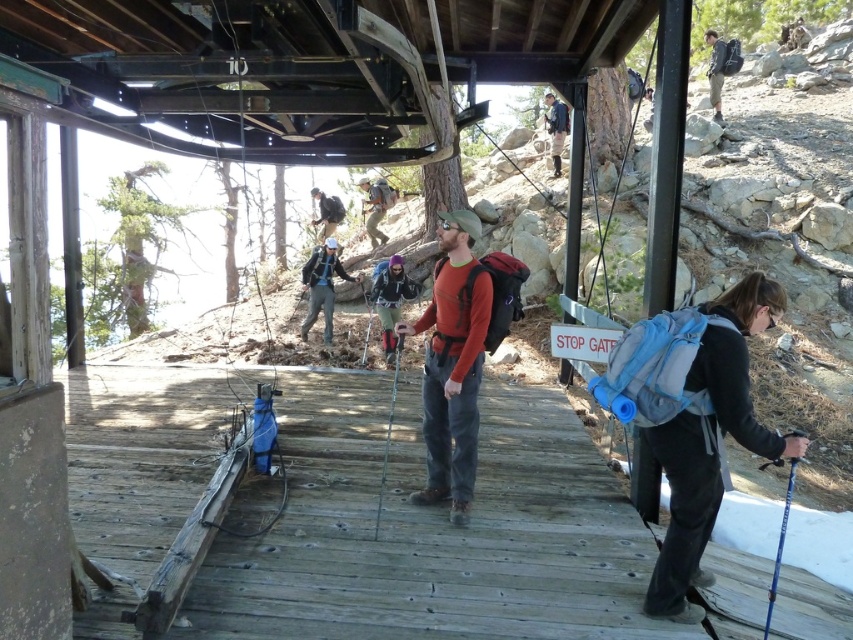
Question: Is orange fleece jacket at center above matte black backpack at center?

Choices:
 (A) yes
 (B) no

Answer: (B)

Question: Observing the image, what is the correct spatial positioning of camouflage fabric backpack at center in reference to metallic silver ski pole at center?

Choices:
 (A) below
 (B) above

Answer: (B)

Question: Which object is closer to the camera taking this photo?

Choices:
 (A) blue metallic ski pole at lower right
 (B) matte gray backpack at center

Answer: (A)

Question: Which point is closer to the camera?

Choices:
 (A) matte gray backpack at center
 (B) blue fabric backpack at right

Answer: (B)

Question: Which of the following is the farthest from the observer?

Choices:
 (A) blue fabric backpack at right
 (B) blue metallic ski pole at lower right

Answer: (B)

Question: Does orange fleece jacket at center come in front of blue metallic ski pole at lower right?

Choices:
 (A) yes
 (B) no

Answer: (B)